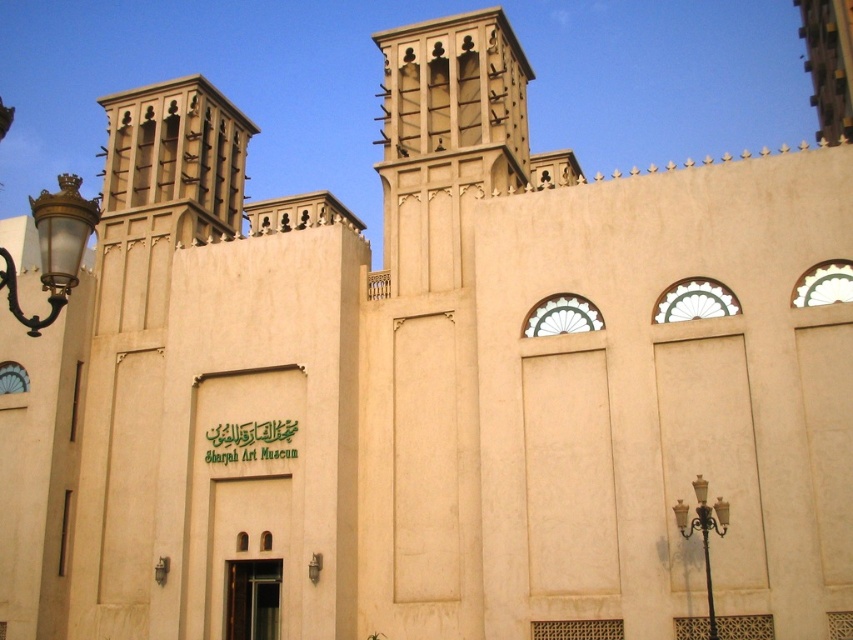
Is beige stone wind tower at upper center positioned before matte brass streetlamp at left?

No, beige stone wind tower at upper center is further to the viewer.

Who is more forward, (x=409, y=88) or (x=54, y=196)?

Point (x=54, y=196)

Locate an element on the screen. This screenshot has height=640, width=853. beige stone wind tower at upper center is located at coordinates (447, 138).

This screenshot has width=853, height=640. I want to click on beige stone wind tower at upper center, so click(447, 138).